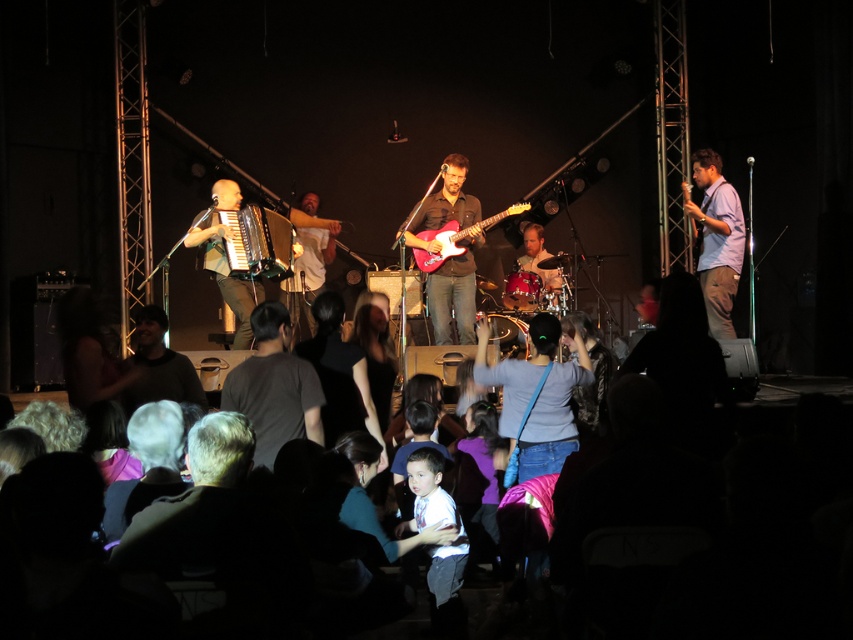
You are a GUI agent. You are given a task and a screenshot of the screen. Output one action in this format:
    pyautogui.click(x=<x>, y=<y>)
    Task: Click on the dark gray t-shirt at center
    The height and width of the screenshot is (640, 853).
    Given the screenshot: What is the action you would take?
    pyautogui.click(x=274, y=387)

Is dark gray t-shirt at center below shiny black accordion at center-left?

Yes, dark gray t-shirt at center is below shiny black accordion at center-left.

Which is in front, point (263, 324) or point (291, 243)?

Point (263, 324)

The width and height of the screenshot is (853, 640). I want to click on dark gray t-shirt at center, so click(x=274, y=387).

Can you confirm if dark gray t-shirt at center is positioned to the left of white t-shirt at center?

In fact, dark gray t-shirt at center is to the right of white t-shirt at center.

Based on the photo, who is positioned more to the left, dark gray t-shirt at center or white t-shirt at center?

white t-shirt at center is more to the left.

Image resolution: width=853 pixels, height=640 pixels. What do you see at coordinates (274, 387) in the screenshot?
I see `dark gray t-shirt at center` at bounding box center [274, 387].

In order to click on dark gray t-shirt at center in this screenshot , I will do `click(274, 387)`.

Is light blue shirt at right wider than matte brown accordion at left?

In fact, light blue shirt at right might be narrower than matte brown accordion at left.

Between light blue shirt at right and matte brown accordion at left, which one is positioned higher?

light blue shirt at right is above.

Between point (738, 276) and point (228, 234), which one is positioned behind?

The point (738, 276) is behind.

Find the location of a particular element. This screenshot has height=640, width=853. light blue shirt at right is located at coordinates (717, 240).